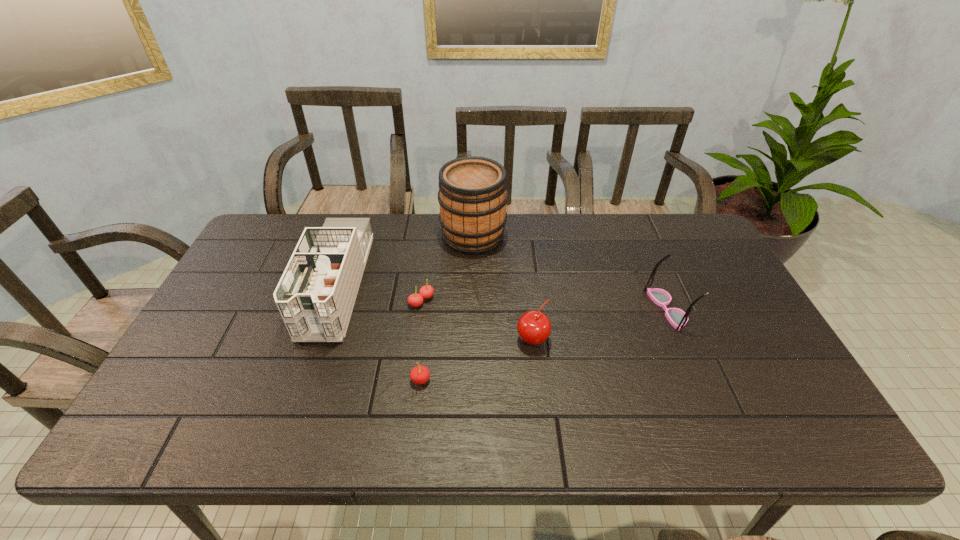
The image size is (960, 540). Find the location of `vacant space that satisfies the following two spatial constraints: 1. at the entrance of the rightmost object; 2. on the right side of the leftmost object`. vacant space that satisfies the following two spatial constraints: 1. at the entrance of the rightmost object; 2. on the right side of the leftmost object is located at coordinates (327, 309).

Identify the location of free spot that satisfies the following two spatial constraints: 1. at the entrance of the second shortest object; 2. on the left side of the leftmost object. 303,380.

You are a GUI agent. You are given a task and a screenshot of the screen. Output one action in this format:
    pyautogui.click(x=<x>, y=<y>)
    Task: Click on the blank space that satisfies the following two spatial constraints: 1. at the entrance of the shortest object; 2. on the right side of the dollhouse
    The height and width of the screenshot is (540, 960).
    Given the screenshot: What is the action you would take?
    pyautogui.click(x=330, y=301)

Where is `vacant area that satisfies the following two spatial constraints: 1. on the front side of the rightmost cherry; 2. on the right side of the shortest cherry`? vacant area that satisfies the following two spatial constraints: 1. on the front side of the rightmost cherry; 2. on the right side of the shortest cherry is located at coordinates (417, 339).